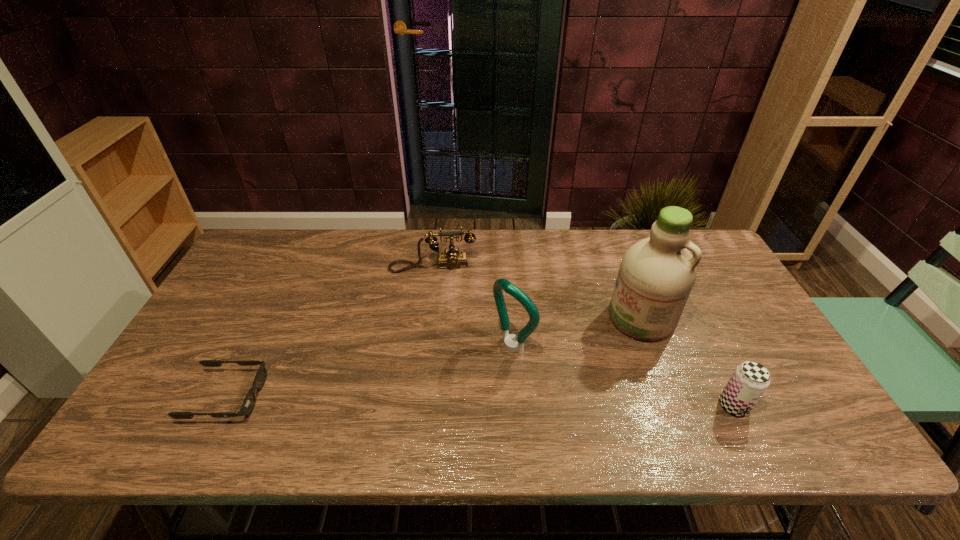
Where is `sunglasses`? Image resolution: width=960 pixels, height=540 pixels. sunglasses is located at coordinates (248, 404).

Find the location of a particular element. the leftmost object is located at coordinates (248, 404).

Find the location of a particular element. beer can is located at coordinates (750, 379).

Where is `telephone`? telephone is located at coordinates (452, 259).

Identify the location of the second object from left to right. (452, 259).

Where is `bottle opener`? bottle opener is located at coordinates 501,284.

Image resolution: width=960 pixels, height=540 pixels. I want to click on the second tallest object, so click(501, 284).

Where is `the second object from right to left`? Image resolution: width=960 pixels, height=540 pixels. the second object from right to left is located at coordinates (656, 275).

This screenshot has height=540, width=960. I want to click on the tallest object, so click(656, 275).

Identify the location of free location located 0.240m on the temples of the sunglasses. The image size is (960, 540). (362, 397).